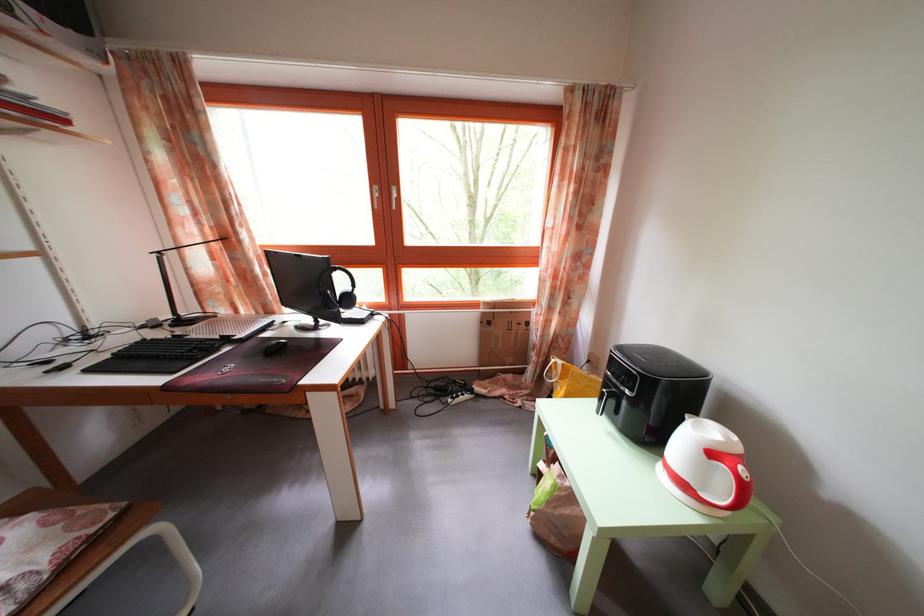
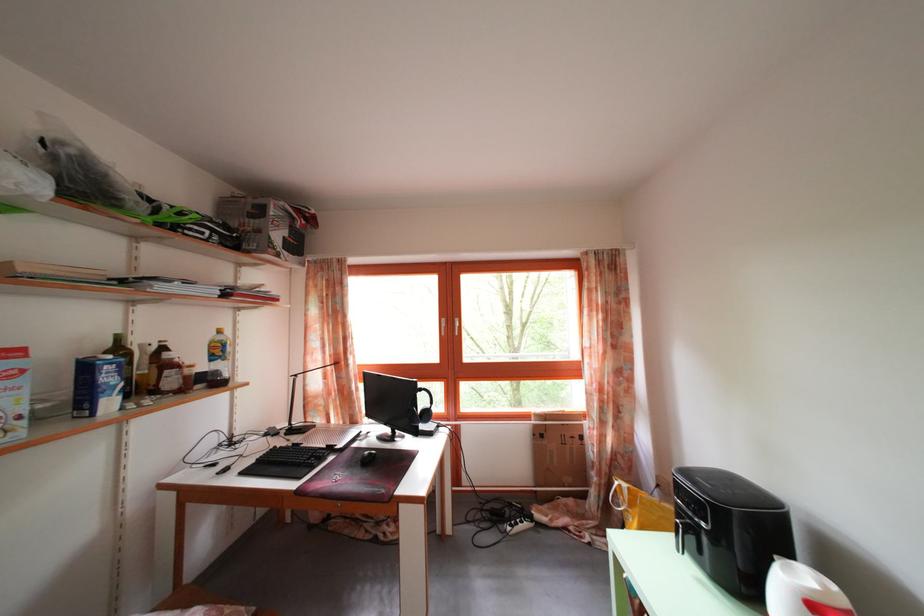
The point at (x=638, y=397) is marked in the first image. Where is the corresponding point in the second image?

(712, 528)